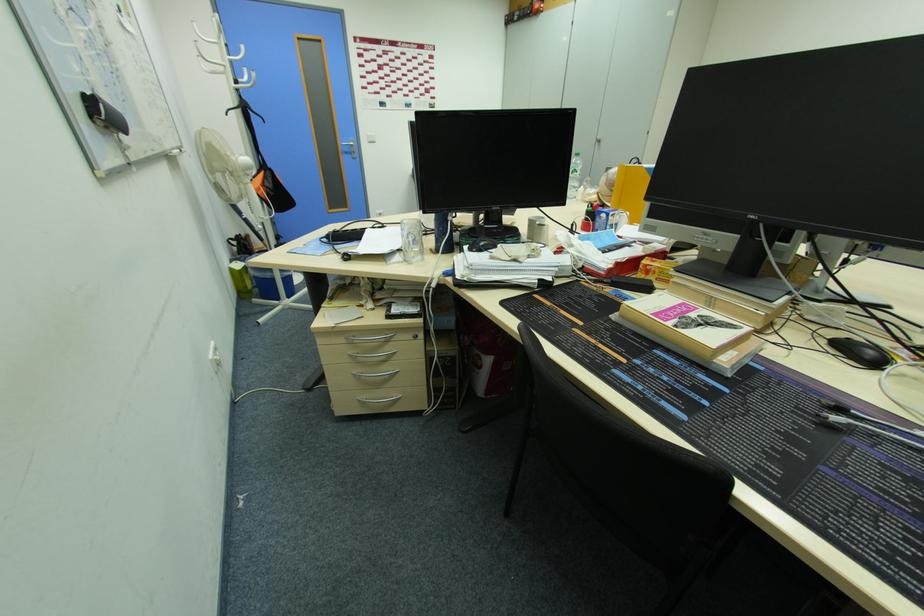
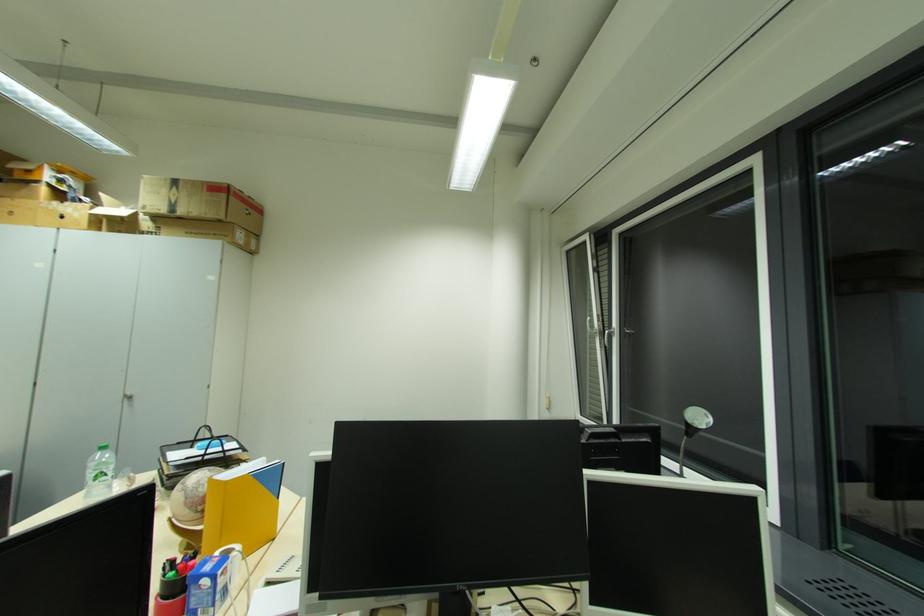
Locate, in the second image, the point that corresponds to the point at 610,185 in the first image.

(189, 506)